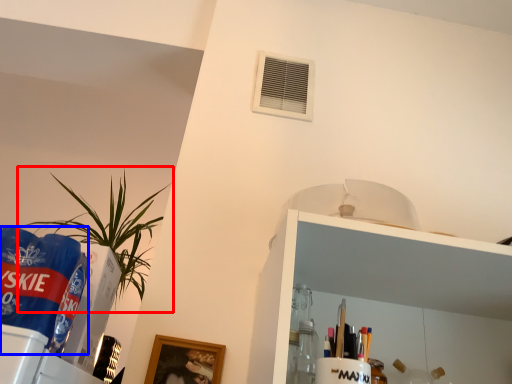
Question: Among these objects, which one is nearest to the camera, houseplant (highlighted by a red box) or beverage (highlighted by a blue box)?

Choices:
 (A) houseplant
 (B) beverage

Answer: (B)